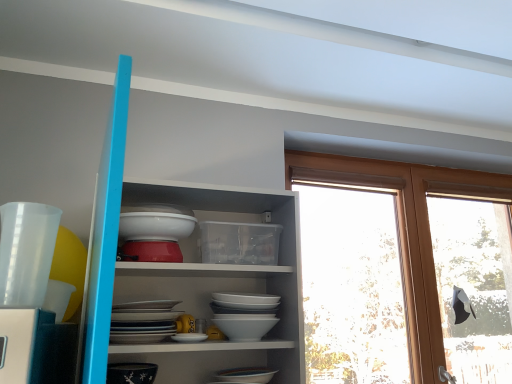
The image size is (512, 384). What do you see at coordinates (26, 252) in the screenshot?
I see `transparent plastic cup at left, the 2th tableware when ordered from back to front` at bounding box center [26, 252].

Locate an element on the screen. The image size is (512, 384). transparent glass window at upper right is located at coordinates (408, 230).

This screenshot has height=384, width=512. Find the location of `black glossy bowl at lower left, which ranks as the 1th tableware in bottom-to-top order`. black glossy bowl at lower left, which ranks as the 1th tableware in bottom-to-top order is located at coordinates (131, 373).

At what (x,y) coordinates should I click in order to perform the action: click on transparent plastic cup at left, the second tableware from the bottom. Please return your answer as a coordinate pair (x, y). The width and height of the screenshot is (512, 384). Looking at the image, I should click on [26, 252].

Would you say transparent plastic cup at left, the second tableware from the bottom, is outside white glossy shelves at upper center?

Indeed, transparent plastic cup at left, the second tableware from the bottom, is completely outside white glossy shelves at upper center.

Consider the image. Which of these two, transparent plastic cup at left, which is the first tableware in front-to-back order, or white glossy shelves at upper center, is wider?

white glossy shelves at upper center is wider.

In order to click on tableware located above the white glossy shelves at upper center (from a real-world perspective) in this screenshot , I will do `click(26, 252)`.

Is transparent plastic cup at left, which ranks as the first tableware in top-to-bottom order, oriented away from white glossy shelves at upper center?

transparent plastic cup at left, which ranks as the first tableware in top-to-bottom order, is not turned away from white glossy shelves at upper center.

Is white glossy bowl at center bigger or smaller than black glossy bowl at lower left, which ranks as the 1th tableware in bottom-to-top order?

Considering their sizes, white glossy bowl at center takes up more space than black glossy bowl at lower left, which ranks as the 1th tableware in bottom-to-top order.

Is black glossy bowl at lower left, which appears as the 2th tableware when viewed from the top, a part of white glossy bowl at center?

Actually, black glossy bowl at lower left, which appears as the 2th tableware when viewed from the top, is outside white glossy bowl at center.

At what (x,y) coordinates should I click in order to perform the action: click on tableware that is the 1st object located in front of the white glossy bowl at center. Please return your answer as a coordinate pair (x, y). Image resolution: width=512 pixels, height=384 pixels. Looking at the image, I should click on 131,373.

Measure the distance from white glossy bowl at center to black glossy bowl at lower left, the second tableware in the front-to-back sequence.

A distance of 14.62 inches exists between white glossy bowl at center and black glossy bowl at lower left, the second tableware in the front-to-back sequence.

From a real-world perspective, is transparent plastic cup at left, which is the first tableware in front-to-back order, beneath transparent glass window at upper right?

Yes, from a real-world perspective, transparent plastic cup at left, which is the first tableware in front-to-back order, is under transparent glass window at upper right.

Between transparent plastic cup at left, the second tableware from the bottom, and transparent glass window at upper right, which one appears on the left side from the viewer's perspective?

transparent plastic cup at left, the second tableware from the bottom.

From their relative heights in the image, would you say transparent plastic cup at left, which is the first tableware in front-to-back order, is taller or shorter than transparent glass window at upper right?

Clearly, transparent plastic cup at left, which is the first tableware in front-to-back order, is shorter compared to transparent glass window at upper right.

Does white glossy bowl at center come behind transparent glass window at upper right?

That is False.

From a real-world perspective, between white glossy bowl at center and transparent glass window at upper right, who is vertically lower?

transparent glass window at upper right, from a real-world perspective.

From the image's perspective, is white glossy bowl at center located above transparent glass window at upper right?

Yes.

Can you confirm if white glossy bowl at center is bigger than transparent glass window at upper right?

Actually, white glossy bowl at center might be smaller than transparent glass window at upper right.

From the image's perspective, which is above, black glossy bowl at lower left, placed as the first tableware when sorted from back to front, or transparent glass window at upper right?

transparent glass window at upper right, from the image's perspective.

Where is `window above the black glossy bowl at lower left, which ranks as the 1th tableware in bottom-to-top order (from a real-world perspective)`? The image size is (512, 384). window above the black glossy bowl at lower left, which ranks as the 1th tableware in bottom-to-top order (from a real-world perspective) is located at coordinates (408, 230).

Who is more distant, black glossy bowl at lower left, which ranks as the 1th tableware in bottom-to-top order, or transparent glass window at upper right?

transparent glass window at upper right is behind.

Does transparent glass window at upper right come behind black glossy bowl at lower left, the second tableware in the front-to-back sequence?

Yes, it is.

Starting from the transparent glass window at upper right, which tableware is the 1st one in front? Please provide its 2D coordinates.

[(131, 373)]

In terms of height, does transparent glass window at upper right look taller or shorter compared to black glossy bowl at lower left, placed as the first tableware when sorted from back to front?

Clearly, transparent glass window at upper right is taller compared to black glossy bowl at lower left, placed as the first tableware when sorted from back to front.

Is white glossy shelves at upper center in contact with transparent plastic cup at left, which is the first tableware in front-to-back order?

No, white glossy shelves at upper center is not beside transparent plastic cup at left, which is the first tableware in front-to-back order.

From the picture: From a real-world perspective, is white glossy shelves at upper center physically below transparent plastic cup at left, which is the first tableware in front-to-back order?

Yes.

Between white glossy shelves at upper center and transparent plastic cup at left, the second tableware from the bottom, which one is positioned in front?

white glossy shelves at upper center is more forward.

This screenshot has height=384, width=512. I want to click on the 2nd tableware to the left of the white glossy shelves at upper center, starting your count from the anchor, so click(26, 252).

Which tableware is the 1st one when counting from the front of the white glossy bowl at center? Please provide its 2D coordinates.

[(131, 373)]

Looking at the image, which one is located further to white glossy bowl at center, transparent plastic cup at left, which is the first tableware in front-to-back order, or black glossy bowl at lower left, placed as the first tableware when sorted from back to front?

The object further to white glossy bowl at center is transparent plastic cup at left, which is the first tableware in front-to-back order.

Based on their spatial positions, is white glossy bowl at center or transparent plastic cup at left, the 2th tableware when ordered from back to front, further from white glossy shelves at upper center?

transparent plastic cup at left, the 2th tableware when ordered from back to front, is further to white glossy shelves at upper center.

Which object lies further to the anchor point black glossy bowl at lower left, the second tableware in the front-to-back sequence, transparent glass window at upper right or transparent plastic cup at left, which is the first tableware in front-to-back order?

transparent glass window at upper right.

When comparing their distances from white glossy shelves at upper center, does transparent plastic cup at left, which is the first tableware in front-to-back order, or white glossy bowl at center seem closer?

white glossy bowl at center.

Looking at the image, which one is located closer to white glossy shelves at upper center, transparent plastic cup at left, the second tableware from the bottom, or black glossy bowl at lower left, which appears as the 2th tableware when viewed from the top?

Among the two, black glossy bowl at lower left, which appears as the 2th tableware when viewed from the top, is located nearer to white glossy shelves at upper center.

Considering their positions, is white glossy bowl at center positioned further to transparent glass window at upper right than transparent plastic cup at left, which is the first tableware in front-to-back order?

transparent plastic cup at left, which is the first tableware in front-to-back order.

When comparing their distances from transparent glass window at upper right, does white glossy shelves at upper center or transparent plastic cup at left, the second tableware from the bottom, seem further?

transparent plastic cup at left, the second tableware from the bottom, is positioned further to the anchor transparent glass window at upper right.

Estimate the real-world distances between objects in this image. Which object is further from white glossy bowl at center, transparent glass window at upper right or black glossy bowl at lower left, which ranks as the 1th tableware in bottom-to-top order?

transparent glass window at upper right lies further to white glossy bowl at center than the other object.

The width and height of the screenshot is (512, 384). In order to click on tableware between transparent plastic cup at left, the 2th tableware when ordered from back to front, and white glossy bowl at center in the front-back direction in this screenshot , I will do `click(131, 373)`.

The image size is (512, 384). Identify the location of tableware between transparent plastic cup at left, which ranks as the first tableware in top-to-bottom order, and transparent glass window at upper right from left to right. (131, 373).

Locate an element on the screen. This screenshot has height=384, width=512. tableware between white glossy shelves at upper center and black glossy bowl at lower left, which appears as the 2th tableware when viewed from the top, in the front-back direction is located at coordinates (26, 252).

This screenshot has height=384, width=512. Find the location of `shelf between black glossy bowl at lower left, placed as the first tableware when sorted from back to front, and transparent glass window at upper right from left to right`. shelf between black glossy bowl at lower left, placed as the first tableware when sorted from back to front, and transparent glass window at upper right from left to right is located at coordinates (188, 269).